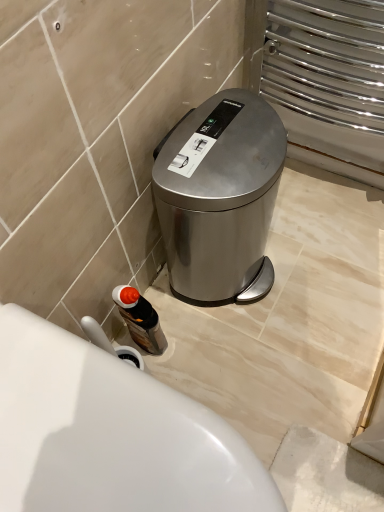
Question: Considering the relative positions of white glossy toilet at lower left and translucent plastic bottle at lower left in the image provided, is white glossy toilet at lower left to the right of translucent plastic bottle at lower left from the viewer's perspective?

Choices:
 (A) yes
 (B) no

Answer: (A)

Question: Is white glossy toilet at lower left wider than translucent plastic bottle at lower left?

Choices:
 (A) no
 (B) yes

Answer: (B)

Question: From the image's perspective, is white glossy toilet at lower left located above translucent plastic bottle at lower left?

Choices:
 (A) no
 (B) yes

Answer: (A)

Question: Is white glossy toilet at lower left shorter than translucent plastic bottle at lower left?

Choices:
 (A) no
 (B) yes

Answer: (A)

Question: Can you confirm if white glossy toilet at lower left is taller than translucent plastic bottle at lower left?

Choices:
 (A) no
 (B) yes

Answer: (B)

Question: From a real-world perspective, is white glossy toilet at lower left located higher than translucent plastic bottle at lower left?

Choices:
 (A) yes
 (B) no

Answer: (A)

Question: Considering the relative sizes of translucent plastic bottle at lower left and satin metallic trash can at lower right in the image provided, is translucent plastic bottle at lower left wider than satin metallic trash can at lower right?

Choices:
 (A) no
 (B) yes

Answer: (A)

Question: Is translucent plastic bottle at lower left taller than satin metallic trash can at lower right?

Choices:
 (A) yes
 (B) no

Answer: (B)

Question: Is translucent plastic bottle at lower left oriented away from satin metallic trash can at lower right?

Choices:
 (A) no
 (B) yes

Answer: (A)

Question: Can we say translucent plastic bottle at lower left lies outside satin metallic trash can at lower right?

Choices:
 (A) no
 (B) yes

Answer: (B)

Question: Considering the relative sizes of translucent plastic bottle at lower left and satin metallic trash can at lower right in the image provided, is translucent plastic bottle at lower left shorter than satin metallic trash can at lower right?

Choices:
 (A) no
 (B) yes

Answer: (B)

Question: Is translucent plastic bottle at lower left in contact with satin metallic trash can at lower right?

Choices:
 (A) yes
 (B) no

Answer: (B)

Question: Does satin metallic trash can at lower right have a greater height compared to translucent plastic bottle at lower left?

Choices:
 (A) no
 (B) yes

Answer: (B)